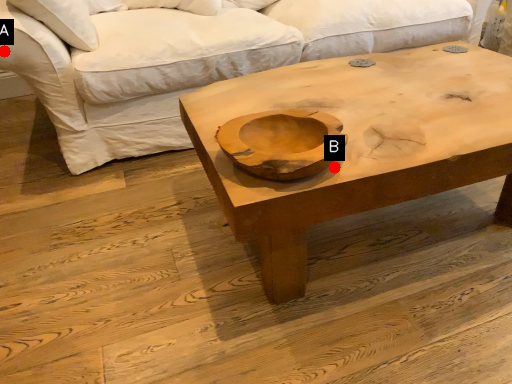
Question: Two points are circled on the image, labeled by A and B beside each circle. Which point appears farthest from the camera in this image?

Choices:
 (A) A is further
 (B) B is further

Answer: (A)